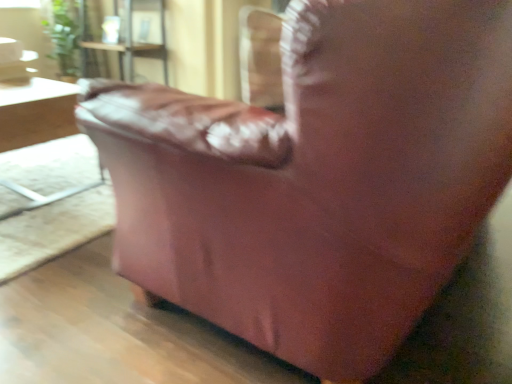
Question: Looking at the image, does light brown wooden table at left seem bigger or smaller compared to green leafy plant at upper left?

Choices:
 (A) big
 (B) small

Answer: (A)

Question: Is point (59, 100) closer or farther from the camera than point (48, 6)?

Choices:
 (A) farther
 (B) closer

Answer: (B)

Question: Would you say light brown wooden table at left is to the left or to the right of green leafy plant at upper left in the picture?

Choices:
 (A) left
 (B) right

Answer: (B)

Question: Is green leafy plant at upper left taller or shorter than light brown wooden table at left?

Choices:
 (A) short
 (B) tall

Answer: (B)

Question: Is green leafy plant at upper left spatially inside light brown wooden table at left, or outside of it?

Choices:
 (A) inside
 (B) outside

Answer: (B)

Question: From a real-world perspective, is green leafy plant at upper left physically located above or below light brown wooden table at left?

Choices:
 (A) above
 (B) below

Answer: (A)

Question: From the image's perspective, is green leafy plant at upper left positioned above or below light brown wooden table at left?

Choices:
 (A) below
 (B) above

Answer: (B)